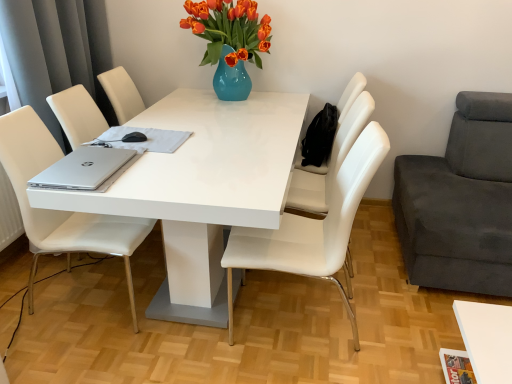
The width and height of the screenshot is (512, 384). I want to click on free space behind white cloth at center, so click(x=169, y=120).